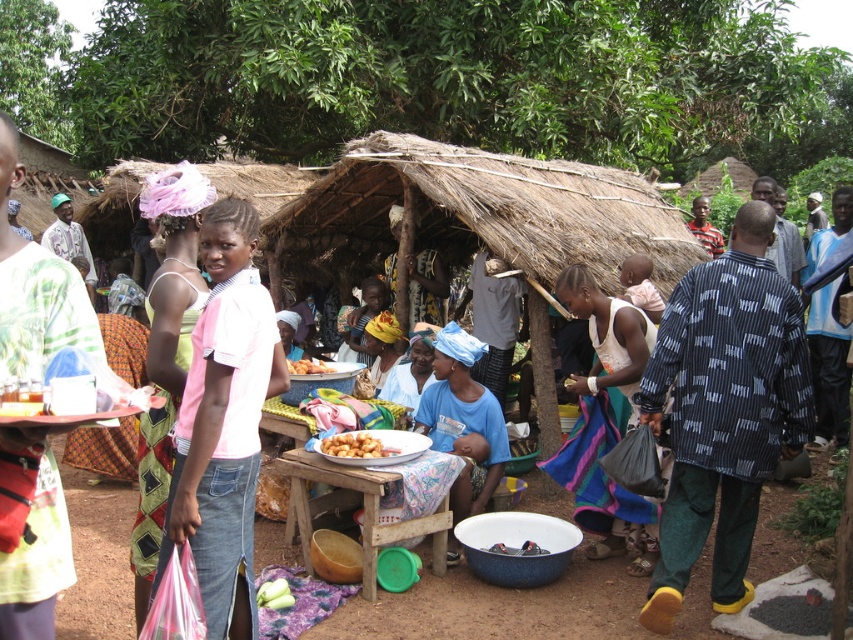
You are standing at the entrance of the market and see the pink cotton shirt at center represented by point (x=224, y=422). Is the pink cotton shirt at center located to the left or right of the center point of the image?

The pink cotton shirt at center represented by point (x=224, y=422) is located to the right of the center point of the image because in coordinate systems, the x value of 0.661 is greater than 0.5, indicating it is to the right.